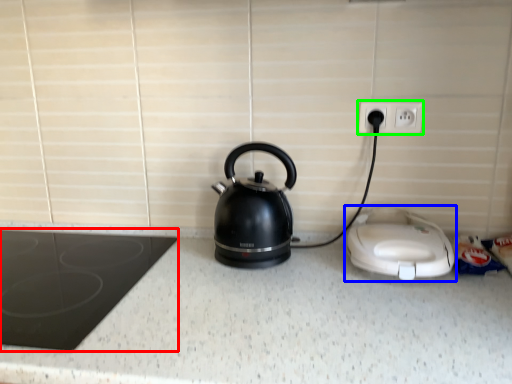
Question: Which is nearer to the home appliance (highlighted by a red box)? home appliance (highlighted by a blue box) or electric outlet (highlighted by a green box).

Choices:
 (A) home appliance
 (B) electric outlet

Answer: (A)